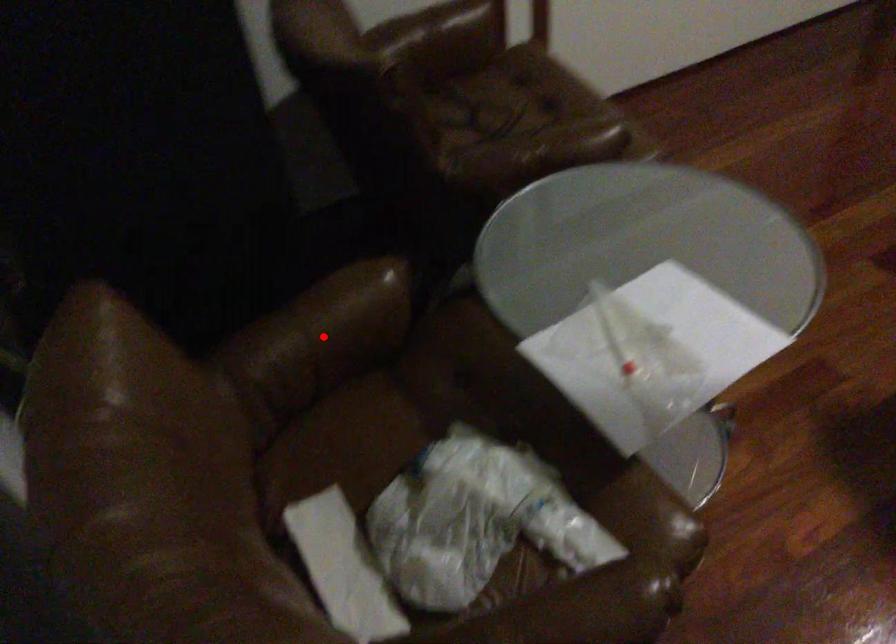
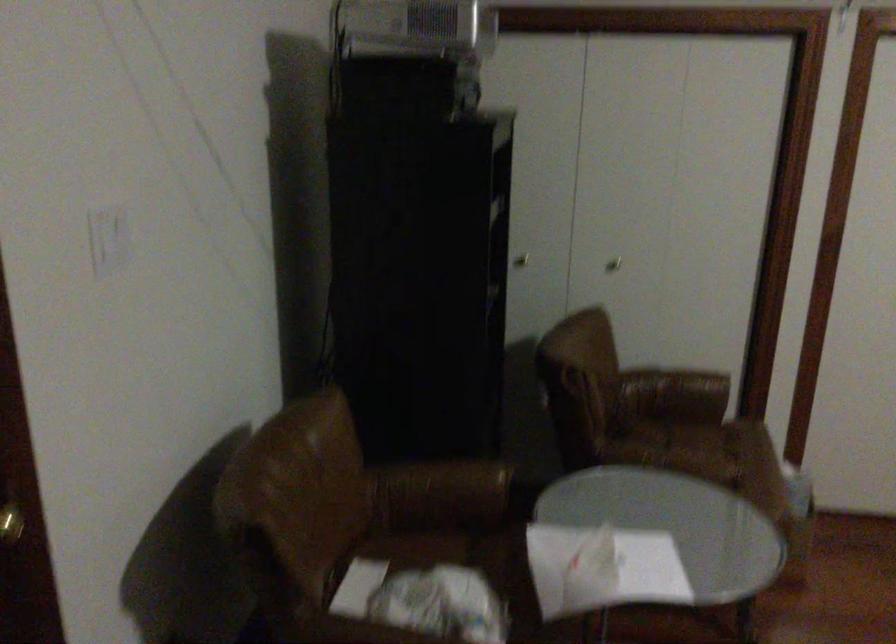
Question: I am providing you with two images of the same scene from different viewpoints. A red point is shown in image1. For the corresponding object point in image2, is it positioned nearer or farther from the camera?

Choices:
 (A) Nearer
 (B) Farther

Answer: (B)